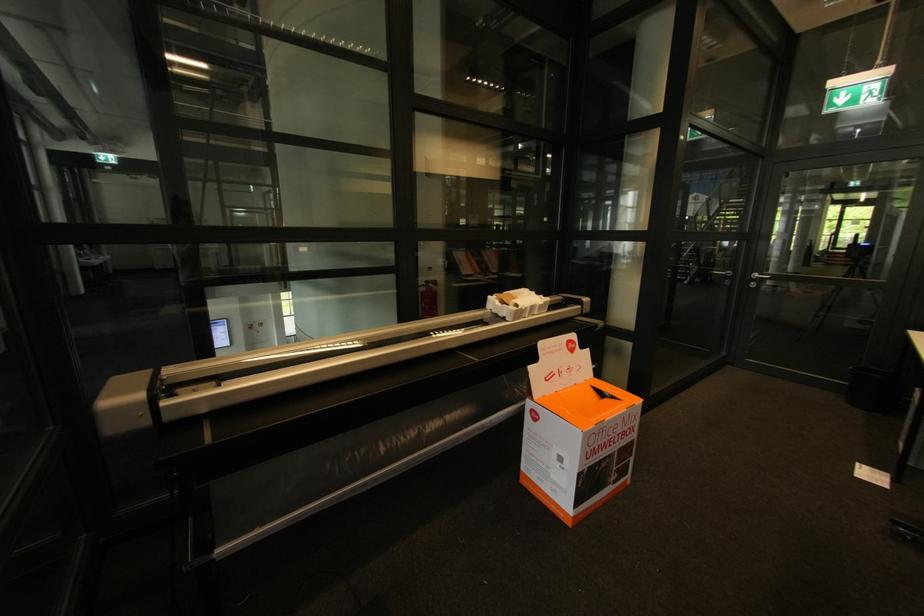
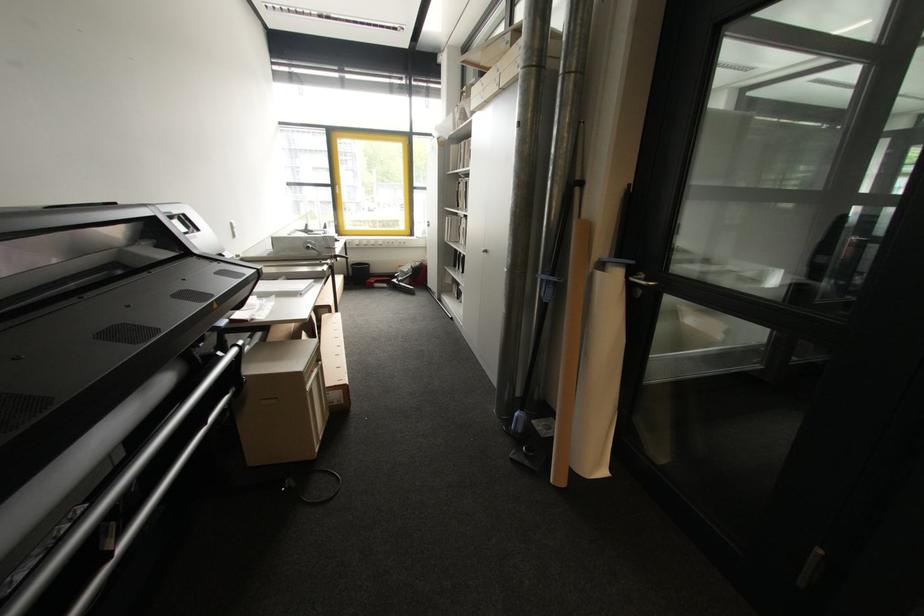
The first image is from the beginning of the video and the second image is from the end. How did the camera likely rotate when shooting the video?

The camera's rotation is toward left-down.